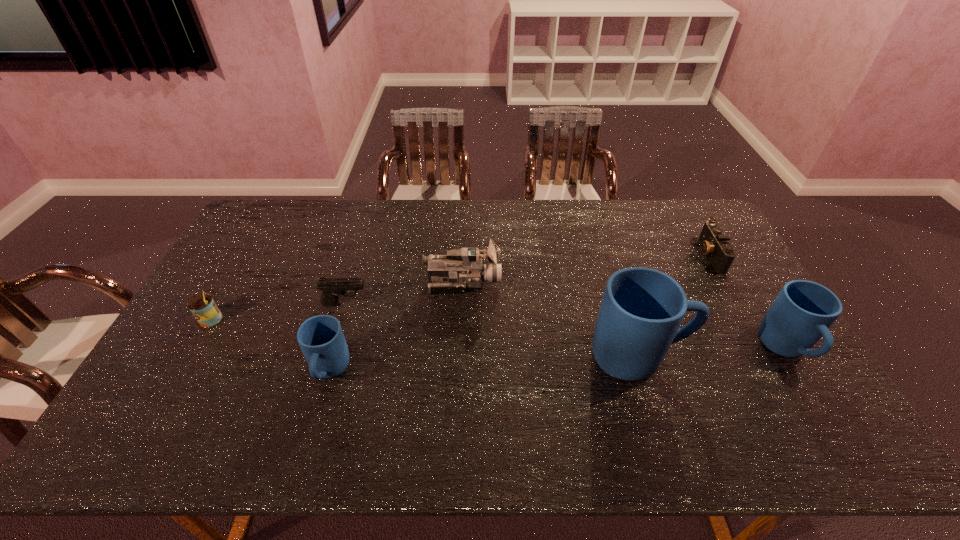
This screenshot has width=960, height=540. I want to click on vacant space located on the front-facing side of the camcorder, so click(557, 282).

Find the location of a particular element. blank space located on the front of the leftmost object is located at coordinates (194, 349).

Locate an element on the screen. The width and height of the screenshot is (960, 540). vacant area located 0.100m on the front-facing side of the camera is located at coordinates (667, 255).

This screenshot has height=540, width=960. In order to click on free space located 0.140m on the front-facing side of the camera in this screenshot , I will do `click(655, 255)`.

Find the location of a particular element. The width and height of the screenshot is (960, 540). free region located on the front-facing side of the camera is located at coordinates (629, 255).

The height and width of the screenshot is (540, 960). Find the location of `vacant space positioned 0.090m at the barrel of the fifth nearest object`. vacant space positioned 0.090m at the barrel of the fifth nearest object is located at coordinates (398, 303).

This screenshot has width=960, height=540. What are the coordinates of `object situated at the far edge` in the screenshot? It's located at (714, 244).

The height and width of the screenshot is (540, 960). Find the location of `object located at the left edge`. object located at the left edge is located at coordinates (204, 309).

This screenshot has height=540, width=960. In order to click on mug that is at the right edge in this screenshot , I will do `click(803, 311)`.

This screenshot has height=540, width=960. I want to click on camera that is at the right edge, so click(714, 244).